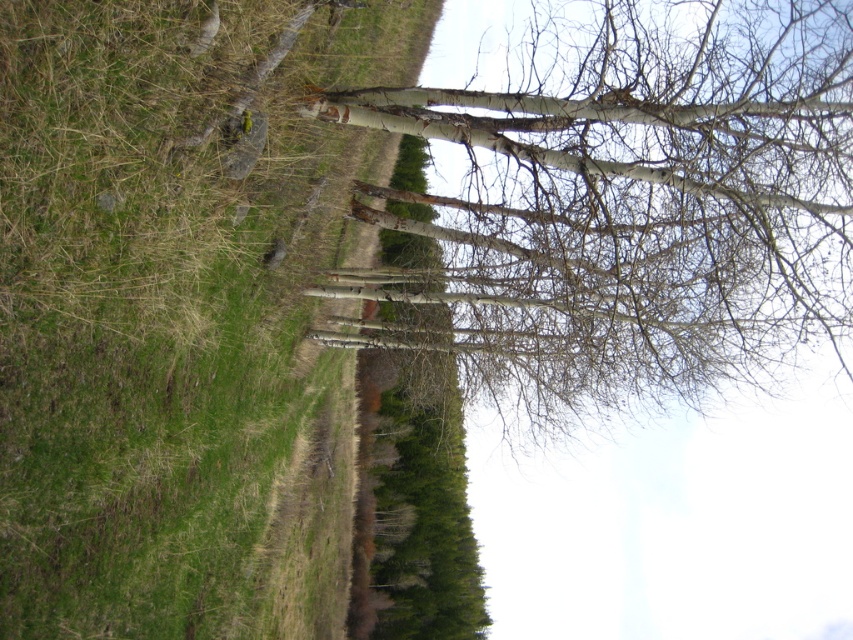
Question: Which of the following is the closest to the observer?

Choices:
 (A) (48, 212)
 (B) (579, 230)

Answer: (A)

Question: Which object appears closest to the camera in this image?

Choices:
 (A) white bark tree at center
 (B) green grass at upper left

Answer: (B)

Question: Is green grass at upper left thinner than white bark tree at center?

Choices:
 (A) yes
 (B) no

Answer: (A)

Question: Does green grass at upper left appear on the left side of white bark tree at center?

Choices:
 (A) no
 (B) yes

Answer: (B)

Question: In this image, where is green grass at upper left located relative to white bark tree at center?

Choices:
 (A) above
 (B) below

Answer: (B)

Question: Among these points, which one is farthest from the camera?

Choices:
 (A) [61, 49]
 (B) [490, 148]

Answer: (B)